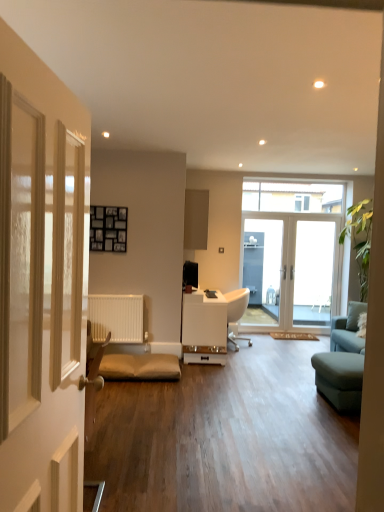
Consider the image. What is the approximate height of clear glass window at upper center?

clear glass window at upper center is 19.75 inches in height.

Describe the element at coordinates (39, 308) in the screenshot. This screenshot has width=384, height=512. I see `white glossy door at left, which is the second door in right-to-left order` at that location.

What do you see at coordinates (313, 273) in the screenshot? This screenshot has height=512, width=384. I see `transparent glass screen door at center` at bounding box center [313, 273].

What is the approximate height of transparent glass screen door at center?

6.34 feet.

You are a GUI agent. You are given a task and a screenshot of the screen. Output one action in this format:
    pyautogui.click(x=<x>, y=<y>)
    Task: Click on the white glossy door at center, the second door when ordered from left to right
    The height and width of the screenshot is (512, 384).
    Given the screenshot: What is the action you would take?
    pyautogui.click(x=295, y=268)

This screenshot has height=512, width=384. Find the location of `white glossy desk at center`. white glossy desk at center is located at coordinates (204, 328).

Describe the element at coordinates (196, 219) in the screenshot. I see `matte gray cabinet at upper center` at that location.

What are the coordinates of `clear glass window at upper center` in the screenshot? It's located at (292, 197).

Is point (245, 206) farther from camera compared to point (188, 242)?

No.

From the image's perspective, between clear glass window at upper center and matte gray cabinet at upper center, who is located below?

matte gray cabinet at upper center, from the image's perspective.

Is clear glass window at upper center in contact with matte gray cabinet at upper center?

clear glass window at upper center and matte gray cabinet at upper center are not in contact.

Does transparent glass screen door at center have a larger size compared to white glossy door at left, which is the second door in right-to-left order?

No, transparent glass screen door at center is not bigger than white glossy door at left, which is the second door in right-to-left order.

Is white glossy door at left, acting as the first door starting from the front, a part of transparent glass screen door at center?

Actually, white glossy door at left, acting as the first door starting from the front, is outside transparent glass screen door at center.

Would you consider transparent glass screen door at center to be distant from white glossy door at left, acting as the first door starting from the front?

Yes, transparent glass screen door at center and white glossy door at left, acting as the first door starting from the front, are located far from each other.

From the image's perspective, is transparent glass screen door at center on white glossy door at left, placed as the 2th door when sorted from back to front?

No.

Is white glossy door at left, the 1th door from the left, taller than matte gray cabinet at upper center?

Yes, white glossy door at left, the 1th door from the left, is taller than matte gray cabinet at upper center.

From the image's perspective, is white glossy door at left, acting as the first door starting from the front, located beneath matte gray cabinet at upper center?

Correct, white glossy door at left, acting as the first door starting from the front, appears lower than matte gray cabinet at upper center in the image.

What's the angular difference between white glossy door at left, the 1th door from the left, and matte gray cabinet at upper center's facing directions?

The angular difference between white glossy door at left, the 1th door from the left, and matte gray cabinet at upper center is 2.03 degrees.

Considering the positions of objects white glossy door at left, which is the second door in right-to-left order, and matte gray cabinet at upper center in the image provided, who is more to the left, white glossy door at left, which is the second door in right-to-left order, or matte gray cabinet at upper center?

From the viewer's perspective, white glossy door at left, which is the second door in right-to-left order, appears more on the left side.

Is clear glass window at upper center inside or outside of transparent glass screen door at center?

clear glass window at upper center lies outside transparent glass screen door at center.

Is transparent glass screen door at center at the back of clear glass window at upper center?

That's not correct — clear glass window at upper center is not looking away from transparent glass screen door at center.

In the scene shown: How far apart are matte gray cabinet at upper center and white glossy door at left, the 1th door from the left?

17.91 feet.

Are matte gray cabinet at upper center and white glossy door at left, which is the second door in right-to-left order, far apart?

Yes, matte gray cabinet at upper center and white glossy door at left, which is the second door in right-to-left order, are quite far apart.

Is matte gray cabinet at upper center situated inside white glossy door at left, the 1th door from the left, or outside?

matte gray cabinet at upper center exists outside the volume of white glossy door at left, the 1th door from the left.

Is matte gray cabinet at upper center bigger than white glossy door at left, which is the second door in right-to-left order?

Actually, matte gray cabinet at upper center might be smaller than white glossy door at left, which is the second door in right-to-left order.

From a real-world perspective, is matte gray cabinet at upper center located higher than clear glass window at upper center?

No.

Based on the photo, considering the sizes of objects matte gray cabinet at upper center and clear glass window at upper center in the image provided, who is wider, matte gray cabinet at upper center or clear glass window at upper center?

Wider between the two is matte gray cabinet at upper center.

Which point is more forward, (190, 227) or (248, 196)?

The point (248, 196) is more forward.

Could you tell me if matte gray cabinet at upper center is facing clear glass window at upper center?

Yes, matte gray cabinet at upper center faces towards clear glass window at upper center.

Is white glossy desk at center not near white glossy door at center, the second door from the front?

white glossy desk at center is far away from white glossy door at center, the second door from the front.

From the picture: Is white glossy desk at center facing away from white glossy door at center, the second door when ordered from left to right?

No, white glossy desk at center's orientation is not away from white glossy door at center, the second door when ordered from left to right.

At what (x,y) coordinates should I click in order to perform the action: click on door that is the 1st object above the white glossy desk at center (from a real-world perspective). Please return your answer as a coordinate pair (x, y). Looking at the image, I should click on (295, 268).

From a real-world perspective, is white glossy desk at center physically located above or below white glossy door at center, which is the 1th door in back-to-front order?

white glossy desk at center is below white glossy door at center, which is the 1th door in back-to-front order.

You are a GUI agent. You are given a task and a screenshot of the screen. Output one action in this format:
    pyautogui.click(x=<x>, y=<y>)
    Task: Click on the cabinetry below the clear glass window at upper center (from the image's perspective)
    This screenshot has width=384, height=512.
    Given the screenshot: What is the action you would take?
    pyautogui.click(x=196, y=219)

The width and height of the screenshot is (384, 512). I want to click on screen door on the right of white glossy door at left, placed as the 2th door when sorted from back to front, so click(x=313, y=273).

Estimate the real-world distances between objects in this image. Which object is further from white glossy door at left, placed as the 2th door when sorted from back to front, white glossy desk at center or white glossy door at center, the second door from the front?

white glossy door at center, the second door from the front, is further to white glossy door at left, placed as the 2th door when sorted from back to front.

Which object lies nearer to the anchor point white glossy desk at center, clear glass window at upper center or white glossy door at center, the second door when ordered from left to right?

Based on the image, white glossy door at center, the second door when ordered from left to right, appears to be nearer to white glossy desk at center.

Which object lies nearer to the anchor point white glossy door at center, the first door positioned from the right, transparent glass screen door at center or white glossy desk at center?

Based on the image, transparent glass screen door at center appears to be nearer to white glossy door at center, the first door positioned from the right.

Looking at the image, which one is located closer to white glossy desk at center, white glossy door at left, acting as the first door starting from the front, or white glossy door at center, the second door when ordered from left to right?

white glossy door at center, the second door when ordered from left to right, is positioned closer to the anchor white glossy desk at center.

Which object lies nearer to the anchor point white glossy door at left, which is the second door in right-to-left order, clear glass window at upper center or white glossy desk at center?

white glossy desk at center.

Based on the photo, based on their spatial positions, is transparent glass screen door at center or white glossy desk at center further from matte gray cabinet at upper center?

transparent glass screen door at center is positioned further to the anchor matte gray cabinet at upper center.

From the image, which object appears to be farther from clear glass window at upper center, transparent glass screen door at center or white glossy desk at center?

Based on the image, white glossy desk at center appears to be further to clear glass window at upper center.

Considering their positions, is white glossy door at left, the 1th door from the left, positioned closer to white glossy desk at center than clear glass window at upper center?

clear glass window at upper center lies closer to white glossy desk at center than the other object.

Identify the location of cabinetry located between white glossy door at left, the 1th door from the left, and clear glass window at upper center in the depth direction. (196, 219).

Locate an element on the screen. cabinetry between white glossy door at left, which is the second door in right-to-left order, and transparent glass screen door at center in the front-back direction is located at coordinates (196, 219).

You are a GUI agent. You are given a task and a screenshot of the screen. Output one action in this format:
    pyautogui.click(x=<x>, y=<y>)
    Task: Click on the cabinetry between clear glass window at upper center and white glossy desk at center vertically
    Image resolution: width=384 pixels, height=512 pixels.
    Given the screenshot: What is the action you would take?
    pyautogui.click(x=196, y=219)

I want to click on door between white glossy door at left, the 1th door from the left, and clear glass window at upper center, along the z-axis, so click(295, 268).